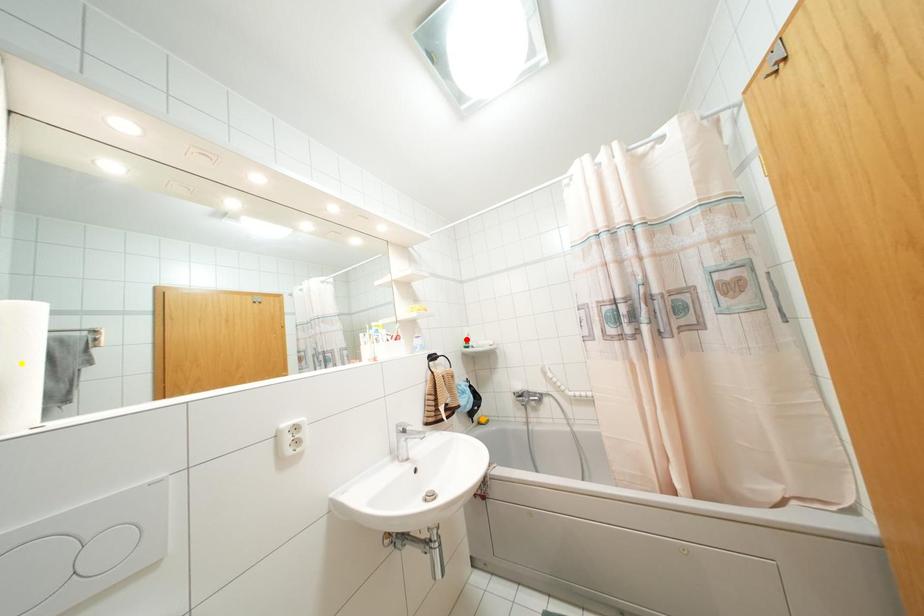
Order these from nearest to farthest:
A) red point
B) orange point
C) yellow point

red point → orange point → yellow point